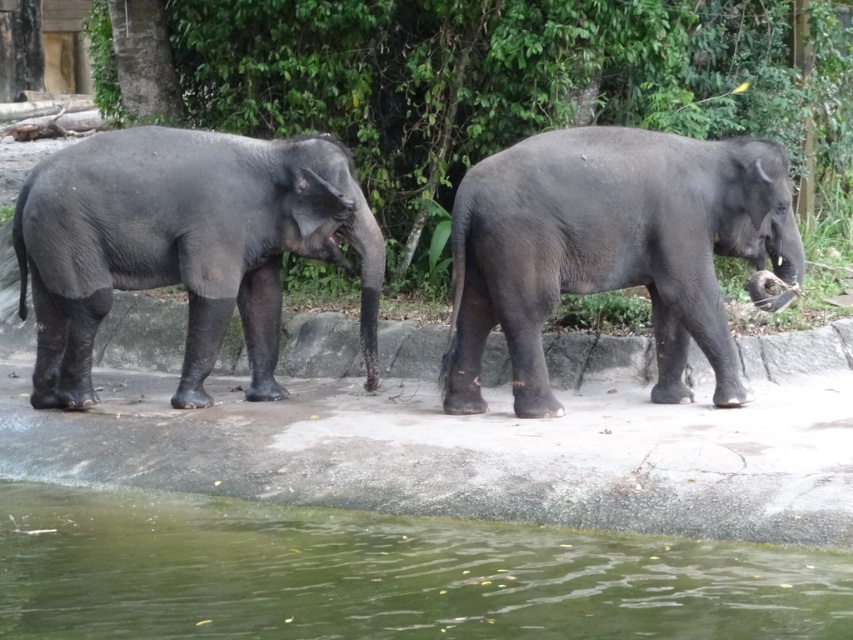
Can you confirm if green liquid water at lower center is bigger than gray matte elephant at right?

No, green liquid water at lower center is not bigger than gray matte elephant at right.

Is point (482, 586) positioned in front of point (730, 225)?

Yes, it is.

Locate an element on the screen. green liquid water at lower center is located at coordinates (381, 573).

Does green liquid water at lower center have a lesser height compared to gray matte elephant at left?

Yes, green liquid water at lower center is shorter than gray matte elephant at left.

Between point (285, 531) and point (339, 211), which one is positioned in front?

Point (285, 531)

Does point (392, 566) come behind point (68, 348)?

No, it is not.

You are a GUI agent. You are given a task and a screenshot of the screen. Output one action in this format:
    pyautogui.click(x=<x>, y=<y>)
    Task: Click on the green liquid water at lower center
    The image size is (853, 640).
    Given the screenshot: What is the action you would take?
    pyautogui.click(x=381, y=573)

Is point (670, 262) behind point (129, 280)?

No, it is not.

Who is shorter, gray matte elephant at right or gray matte elephant at left?

gray matte elephant at right

You are a GUI agent. You are given a task and a screenshot of the screen. Output one action in this format:
    pyautogui.click(x=<x>, y=<y>)
    Task: Click on the gray matte elephant at right
    The height and width of the screenshot is (640, 853).
    Given the screenshot: What is the action you would take?
    pyautogui.click(x=610, y=248)